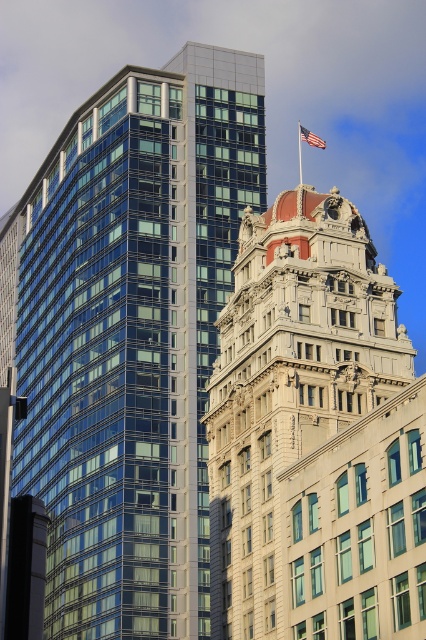
You are a drone operator tasked with capturing aerial footage of the city. Your drone is currently hovering at point (314,436). What object is located exactly at your current position?

The white stone tower at center is located exactly at point (314,436).

You are a photographer wanting to capture both the white stone tower at center and the american flag at center in a single frame. Which object should you focus on first to ensure both are in the frame without moving the camera?

You should focus on the white stone tower at center first because it is taller than the american flag at center, so by focusing on the tower, you can adjust the camera to include both objects in the frame.

You are standing in the middle of a city square and see the glassy steel skyscraper at left. If you want to take a photo of it from a distance of 80 meters, can you do so without moving from your current position?

The glassy steel skyscraper at left is 82.36 meters away from the viewer. Since you need to be 80 meters away, you are already slightly farther than that, so you cannot take the photo from your current position without moving closer.